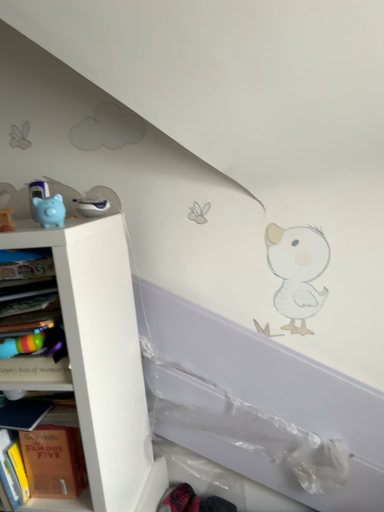
Question: In terms of size, does hardcover book at left, the first shelf viewed from the top, appear bigger or smaller than multicolored plastic bookshelf at left?

Choices:
 (A) small
 (B) big

Answer: (A)

Question: From a real-world perspective, relative to multicolored plastic bookshelf at left, is hardcover book at left, the second shelf from the bottom, vertically above or below?

Choices:
 (A) above
 (B) below

Answer: (B)

Question: Which object is the farthest from the white matte shelf at left, which appears as the second shelf when viewed from the top?

Choices:
 (A) hardcover book at left, the first shelf viewed from the top
 (B) multicolored plastic bookshelf at left
 (C) blue rubber piggy bank at left

Answer: (C)

Question: Which object is the farthest from the multicolored plastic bookshelf at left?

Choices:
 (A) blue rubber piggy bank at left
 (B) hardcover book at left, the first shelf viewed from the top
 (C) white matte shelf at left, which is the 1th shelf in bottom-to-top order

Answer: (A)